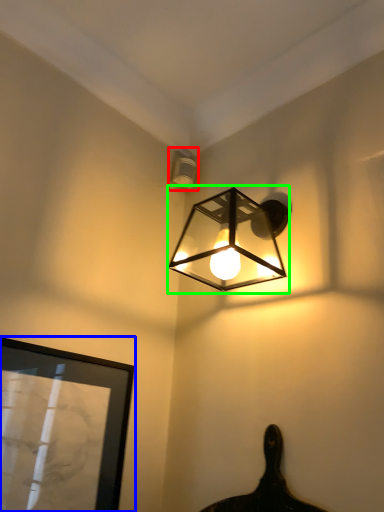
Question: Which object is the farthest from lamp (highlighted by a red box)? Choose among these: picture frame (highlighted by a blue box) or lamp (highlighted by a green box).

Choices:
 (A) picture frame
 (B) lamp

Answer: (A)